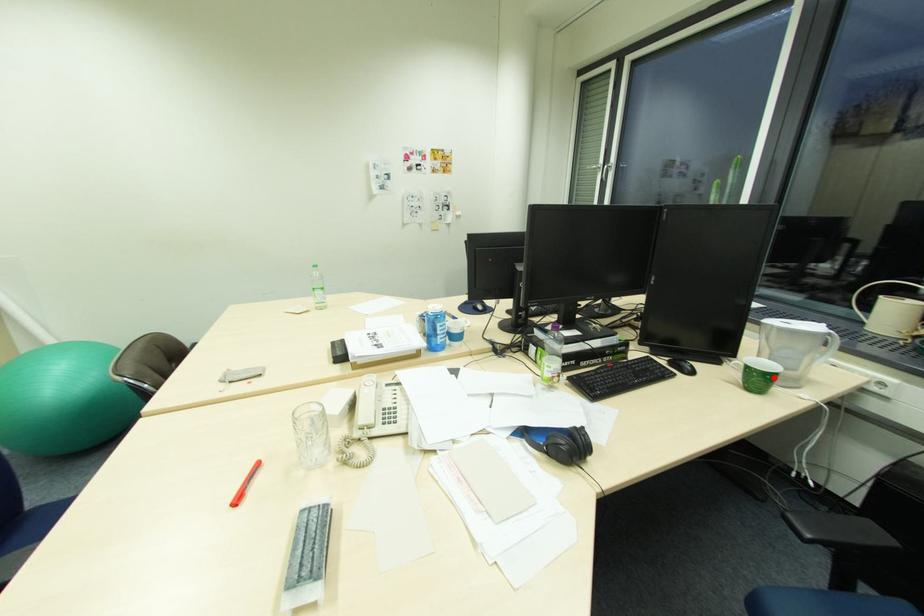
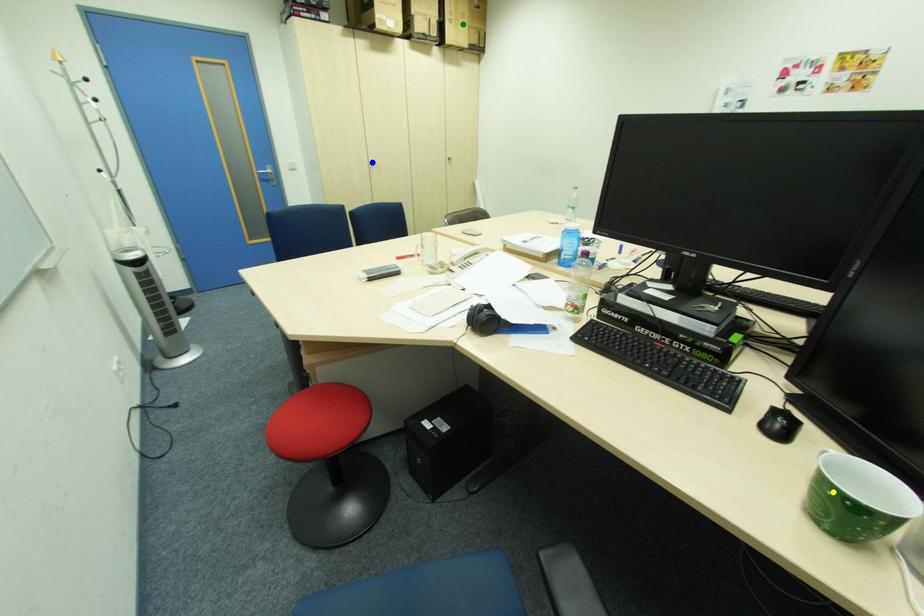
Question: I am providing you with two images of the same scene from different viewpoints. A red point is marked on the first image. You are given multiple points on the second image. Which point in image 2 represents the same 3d spot as the red point in image 1?

Choices:
 (A) blue point
 (B) green point
 (C) yellow point

Answer: (C)